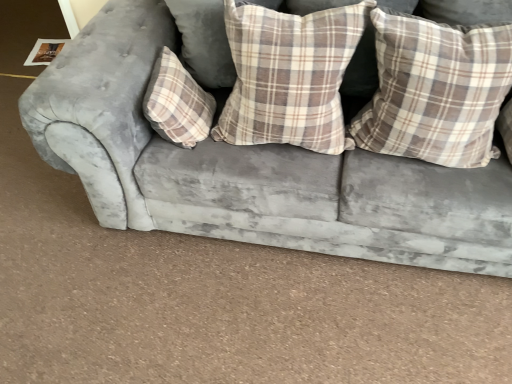
How much space does plaid fabric pillow at center, the second pillow when ordered from left to right, occupy vertically?

plaid fabric pillow at center, the second pillow when ordered from left to right, is 15.43 inches in height.

Locate an element on the screen. plaid fabric pillow at upper right, the first pillow in the right-to-left sequence is located at coordinates (435, 90).

Find the location of a particular element. The height and width of the screenshot is (384, 512). velvet gray couch at center is located at coordinates (251, 168).

Find the location of a particular element. This screenshot has width=512, height=384. plaid fabric pillow at center, the second pillow when ordered from left to right is located at coordinates (289, 75).

Is plaid fabric pillow at center, the third pillow positioned from the right, next to plaid fabric pillow at center, the second pillow when ordered from left to right?

No, plaid fabric pillow at center, the third pillow positioned from the right, is not next to plaid fabric pillow at center, the second pillow when ordered from left to right.

Is plaid fabric pillow at center, the third pillow positioned from the right, oriented away from plaid fabric pillow at center, the 2th pillow from the right?

No, plaid fabric pillow at center, the 2th pillow from the right, is not at the back of plaid fabric pillow at center, the third pillow positioned from the right.

Considering the relative sizes of plaid fabric pillow at center, the first pillow in the left-to-right sequence, and plaid fabric pillow at center, the second pillow when ordered from left to right, in the image provided, is plaid fabric pillow at center, the first pillow in the left-to-right sequence, smaller than plaid fabric pillow at center, the second pillow when ordered from left to right,?

Yes.

Can you confirm if plaid fabric pillow at center, the third pillow positioned from the right, is shorter than plaid fabric pillow at center, the second pillow when ordered from left to right?

Yes, plaid fabric pillow at center, the third pillow positioned from the right, is shorter than plaid fabric pillow at center, the second pillow when ordered from left to right.

Can you confirm if plaid fabric pillow at upper right, which is the third pillow in left-to-right order, is positioned to the left of plaid fabric pillow at center, the 2th pillow from the right?

Incorrect, plaid fabric pillow at upper right, which is the third pillow in left-to-right order, is not on the left side of plaid fabric pillow at center, the 2th pillow from the right.

Does plaid fabric pillow at upper right, which is the third pillow in left-to-right order, come in front of plaid fabric pillow at center, the 2th pillow from the right?

Yes, it is.

From the picture: Which of these two, plaid fabric pillow at upper right, which is the third pillow in left-to-right order, or plaid fabric pillow at center, the second pillow when ordered from left to right, stands taller?

Standing taller between the two is plaid fabric pillow at center, the second pillow when ordered from left to right.

From the image's perspective, is plaid fabric pillow at upper right, the first pillow in the right-to-left sequence, above or below plaid fabric pillow at center, the second pillow when ordered from left to right?

Based on their image positions, plaid fabric pillow at upper right, the first pillow in the right-to-left sequence, is located beneath plaid fabric pillow at center, the second pillow when ordered from left to right.

Between plaid fabric pillow at center, the second pillow when ordered from left to right, and plaid fabric pillow at upper right, the first pillow in the right-to-left sequence, which one has larger width?

plaid fabric pillow at upper right, the first pillow in the right-to-left sequence, is wider.

Considering the relative positions of plaid fabric pillow at center, the 2th pillow from the right, and plaid fabric pillow at upper right, which is the third pillow in left-to-right order, in the image provided, is plaid fabric pillow at center, the 2th pillow from the right, to the right of plaid fabric pillow at upper right, which is the third pillow in left-to-right order, from the viewer's perspective?

In fact, plaid fabric pillow at center, the 2th pillow from the right, is to the left of plaid fabric pillow at upper right, which is the third pillow in left-to-right order.

Could you tell me if plaid fabric pillow at center, the second pillow when ordered from left to right, is facing plaid fabric pillow at upper right, which is the third pillow in left-to-right order?

No, plaid fabric pillow at center, the second pillow when ordered from left to right, is not oriented towards plaid fabric pillow at upper right, which is the third pillow in left-to-right order.

Is plaid fabric pillow at center, the 2th pillow from the right, next to plaid fabric pillow at upper right, the first pillow in the right-to-left sequence, and touching it?

They are not placed beside each other.

Is plaid fabric pillow at center, the 2th pillow from the right, directly adjacent to velvet gray couch at center?

No, plaid fabric pillow at center, the 2th pillow from the right, is not with velvet gray couch at center.

In the image, is plaid fabric pillow at center, the second pillow when ordered from left to right, positioned in front of or behind velvet gray couch at center?

plaid fabric pillow at center, the second pillow when ordered from left to right, is behind velvet gray couch at center.

Between plaid fabric pillow at center, the second pillow when ordered from left to right, and velvet gray couch at center, which one has larger size?

velvet gray couch at center.

Are plaid fabric pillow at center, the first pillow in the left-to-right sequence, and plaid fabric pillow at upper right, the first pillow in the right-to-left sequence, located far from each other?

They are positioned close to each other.

Does plaid fabric pillow at center, the third pillow positioned from the right, turn towards plaid fabric pillow at upper right, the first pillow in the right-to-left sequence?

Yes, plaid fabric pillow at center, the third pillow positioned from the right, is turned towards plaid fabric pillow at upper right, the first pillow in the right-to-left sequence.

From the image's perspective, is plaid fabric pillow at center, the third pillow positioned from the right, over plaid fabric pillow at upper right, which is the third pillow in left-to-right order?

No, from the image's perspective, plaid fabric pillow at center, the third pillow positioned from the right, is not over plaid fabric pillow at upper right, which is the third pillow in left-to-right order.

In the scene shown: Looking at their sizes, would you say plaid fabric pillow at center, the third pillow positioned from the right, is wider or thinner than plaid fabric pillow at upper right, the first pillow in the right-to-left sequence?

plaid fabric pillow at center, the third pillow positioned from the right, is thinner than plaid fabric pillow at upper right, the first pillow in the right-to-left sequence.

Could you tell me if plaid fabric pillow at center, the second pillow when ordered from left to right, is turned towards plaid fabric pillow at center, the first pillow in the left-to-right sequence?

No, plaid fabric pillow at center, the second pillow when ordered from left to right, is not oriented towards plaid fabric pillow at center, the first pillow in the left-to-right sequence.

From the image's perspective, count 2nd pillows downward from the plaid fabric pillow at center, the second pillow when ordered from left to right, and point to it. Please provide its 2D coordinates.

[(177, 103)]

Is plaid fabric pillow at center, the 2th pillow from the right, wider or thinner than plaid fabric pillow at center, the third pillow positioned from the right?

plaid fabric pillow at center, the 2th pillow from the right, is wider than plaid fabric pillow at center, the third pillow positioned from the right.

From a real-world perspective, is plaid fabric pillow at center, the second pillow when ordered from left to right, positioned under plaid fabric pillow at center, the first pillow in the left-to-right sequence, based on gravity?

Incorrect, from a real-world perspective, plaid fabric pillow at center, the second pillow when ordered from left to right, is higher than plaid fabric pillow at center, the first pillow in the left-to-right sequence.

How far apart are plaid fabric pillow at upper right, the first pillow in the right-to-left sequence, and plaid fabric pillow at center, the third pillow positioned from the right?

The distance of plaid fabric pillow at upper right, the first pillow in the right-to-left sequence, from plaid fabric pillow at center, the third pillow positioned from the right, is 26.72 inches.

Considering the relative positions of plaid fabric pillow at upper right, the first pillow in the right-to-left sequence, and plaid fabric pillow at center, the first pillow in the left-to-right sequence, in the image provided, is plaid fabric pillow at upper right, the first pillow in the right-to-left sequence, to the right of plaid fabric pillow at center, the first pillow in the left-to-right sequence, from the viewer's perspective?

Correct, you'll find plaid fabric pillow at upper right, the first pillow in the right-to-left sequence, to the right of plaid fabric pillow at center, the first pillow in the left-to-right sequence.

You are a GUI agent. You are given a task and a screenshot of the screen. Output one action in this format:
    pyautogui.click(x=<x>, y=<y>)
    Task: Click on the 2nd pillow below the plaid fabric pillow at center, the second pillow when ordered from left to right (from the image's perspective)
    The width and height of the screenshot is (512, 384).
    Given the screenshot: What is the action you would take?
    pyautogui.click(x=177, y=103)

The height and width of the screenshot is (384, 512). There is a plaid fabric pillow at center, the 2th pillow from the right. Identify the location of pillow above it (from a real-world perspective). (435, 90).

Estimate the real-world distances between objects in this image. Which object is further from velvet gray couch at center, plaid fabric pillow at upper right, the first pillow in the right-to-left sequence, or plaid fabric pillow at center, the third pillow positioned from the right?

The object further to velvet gray couch at center is plaid fabric pillow at upper right, the first pillow in the right-to-left sequence.

Looking at this image, considering their positions, is velvet gray couch at center positioned closer to plaid fabric pillow at center, the first pillow in the left-to-right sequence, than plaid fabric pillow at center, the 2th pillow from the right?

velvet gray couch at center is closer to plaid fabric pillow at center, the first pillow in the left-to-right sequence.

Based on their spatial positions, is plaid fabric pillow at upper right, the first pillow in the right-to-left sequence, or plaid fabric pillow at center, the first pillow in the left-to-right sequence, further from plaid fabric pillow at center, the second pillow when ordered from left to right?

Among the two, plaid fabric pillow at center, the first pillow in the left-to-right sequence, is located further to plaid fabric pillow at center, the second pillow when ordered from left to right.

In the scene shown: Which object lies further to the anchor point plaid fabric pillow at center, the first pillow in the left-to-right sequence, velvet gray couch at center or plaid fabric pillow at upper right, the first pillow in the right-to-left sequence?

→ plaid fabric pillow at upper right, the first pillow in the right-to-left sequence, lies further to plaid fabric pillow at center, the first pillow in the left-to-right sequence, than the other object.

Estimate the real-world distances between objects in this image. Which object is further from plaid fabric pillow at upper right, which is the third pillow in left-to-right order, plaid fabric pillow at center, the 2th pillow from the right, or plaid fabric pillow at center, the third pillow positioned from the right?

plaid fabric pillow at center, the third pillow positioned from the right, lies further to plaid fabric pillow at upper right, which is the third pillow in left-to-right order, than the other object.

From the image, which object appears to be farther from plaid fabric pillow at upper right, the first pillow in the right-to-left sequence, velvet gray couch at center or plaid fabric pillow at center, the first pillow in the left-to-right sequence?

Based on the image, plaid fabric pillow at center, the first pillow in the left-to-right sequence, appears to be further to plaid fabric pillow at upper right, the first pillow in the right-to-left sequence.

Which object lies nearer to the anchor point plaid fabric pillow at center, the third pillow positioned from the right, plaid fabric pillow at upper right, the first pillow in the right-to-left sequence, or plaid fabric pillow at center, the 2th pillow from the right?

Based on the image, plaid fabric pillow at center, the 2th pillow from the right, appears to be nearer to plaid fabric pillow at center, the third pillow positioned from the right.

Looking at the image, which one is located closer to plaid fabric pillow at center, the 2th pillow from the right, plaid fabric pillow at upper right, which is the third pillow in left-to-right order, or velvet gray couch at center?

plaid fabric pillow at upper right, which is the third pillow in left-to-right order, is closer to plaid fabric pillow at center, the 2th pillow from the right.

Find the location of a particular element. The height and width of the screenshot is (384, 512). pillow situated between plaid fabric pillow at center, the third pillow positioned from the right, and plaid fabric pillow at upper right, which is the third pillow in left-to-right order, from left to right is located at coordinates (289, 75).

The image size is (512, 384). In order to click on studio couch between plaid fabric pillow at center, the first pillow in the left-to-right sequence, and plaid fabric pillow at upper right, which is the third pillow in left-to-right order, in the horizontal direction in this screenshot , I will do `click(251, 168)`.

In order to click on studio couch located between plaid fabric pillow at center, the 2th pillow from the right, and plaid fabric pillow at upper right, which is the third pillow in left-to-right order, in the left-right direction in this screenshot , I will do `click(251, 168)`.

At what (x,y) coordinates should I click in order to perform the action: click on pillow situated between plaid fabric pillow at center, the first pillow in the left-to-right sequence, and velvet gray couch at center from left to right. Please return your answer as a coordinate pair (x, y). This screenshot has height=384, width=512. Looking at the image, I should click on (289, 75).